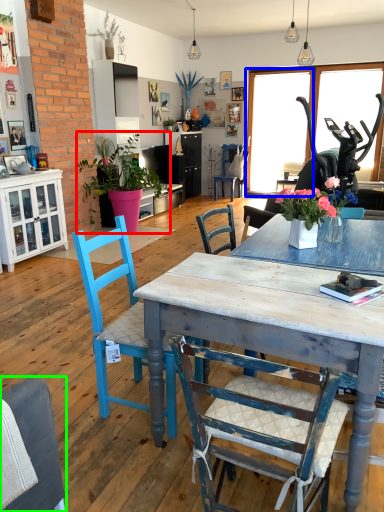
Question: Estimate the real-world distances between objects in this image. Which object is farther from houseplant (highlighted by a red box), window screen (highlighted by a blue box) or chair (highlighted by a green box)?

Choices:
 (A) window screen
 (B) chair

Answer: (B)